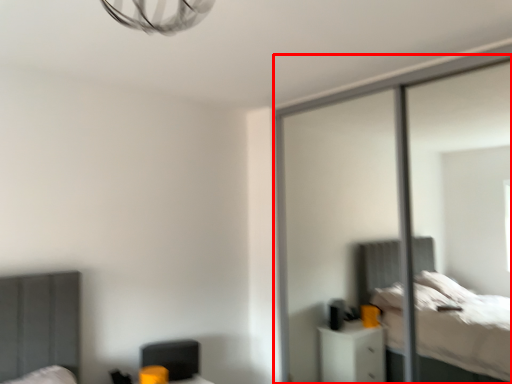
Question: Observing the image, what is the correct spatial positioning of screen door (annotated by the red box) in reference to swivel chair?

Choices:
 (A) left
 (B) right

Answer: (B)